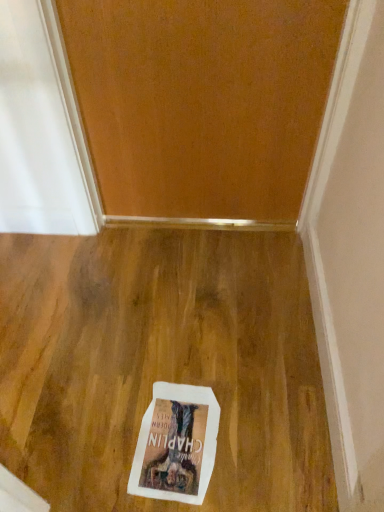
Question: Can you confirm if white paper postcard at center is shorter than wooden door at upper center?

Choices:
 (A) no
 (B) yes

Answer: (B)

Question: Does white paper postcard at center have a larger size compared to wooden door at upper center?

Choices:
 (A) no
 (B) yes

Answer: (A)

Question: Does white paper postcard at center have a greater width compared to wooden door at upper center?

Choices:
 (A) yes
 (B) no

Answer: (A)

Question: From the image's perspective, is white paper postcard at center on wooden door at upper center?

Choices:
 (A) no
 (B) yes

Answer: (A)

Question: Is white paper postcard at center to the left of wooden door at upper center from the viewer's perspective?

Choices:
 (A) no
 (B) yes

Answer: (B)

Question: Does white paper postcard at center come behind wooden door at upper center?

Choices:
 (A) no
 (B) yes

Answer: (B)

Question: Is wooden door at upper center oriented away from white paper postcard at center?

Choices:
 (A) no
 (B) yes

Answer: (A)

Question: Is wooden door at upper center closer to the viewer compared to white paper postcard at center?

Choices:
 (A) yes
 (B) no

Answer: (A)

Question: Is there a large distance between wooden door at upper center and white paper postcard at center?

Choices:
 (A) yes
 (B) no

Answer: (B)

Question: Is wooden door at upper center at the left side of white paper postcard at center?

Choices:
 (A) no
 (B) yes

Answer: (A)

Question: Can we say wooden door at upper center lies outside white paper postcard at center?

Choices:
 (A) yes
 (B) no

Answer: (A)

Question: Does wooden door at upper center have a greater height compared to white paper postcard at center?

Choices:
 (A) no
 (B) yes

Answer: (B)

Question: Is white paper postcard at center taller or shorter than wooden door at upper center?

Choices:
 (A) tall
 (B) short

Answer: (B)